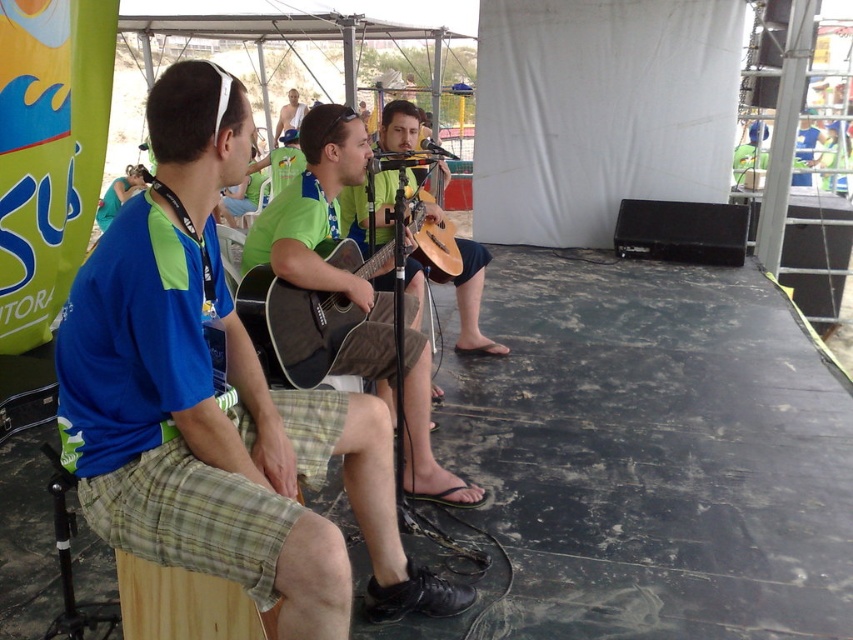
Question: Is blue fabric shirt at left wider than green fabric shirt at center?

Choices:
 (A) no
 (B) yes

Answer: (B)

Question: Does green fabric shirt at center have a greater width compared to matte black acoustic guitar at center?

Choices:
 (A) yes
 (B) no

Answer: (A)

Question: Which point is farther to the camera?

Choices:
 (A) (x=383, y=332)
 (B) (x=302, y=365)

Answer: (A)

Question: Which of the following is the farthest from the observer?

Choices:
 (A) (323, 269)
 (B) (347, 248)

Answer: (B)

Question: In this image, where is green fabric shirt at center located relative to matte black acoustic guitar at center?

Choices:
 (A) right
 (B) left

Answer: (A)

Question: Considering the real-world distances, which object is closest to the blue fabric shirt at left?

Choices:
 (A) matte black acoustic guitar at center
 (B) green fabric shirt at center

Answer: (B)